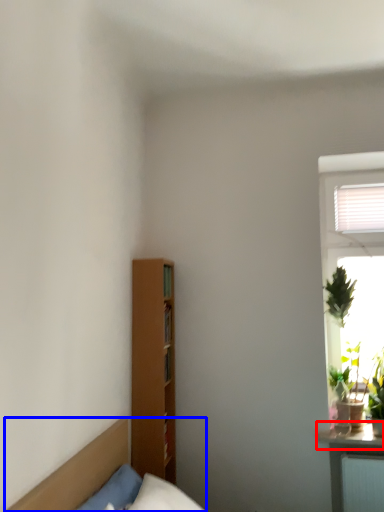
Question: Which object appears closest to the camera in this image, window sill (highlighted by a red box) or furniture (highlighted by a blue box)?

Choices:
 (A) window sill
 (B) furniture

Answer: (B)